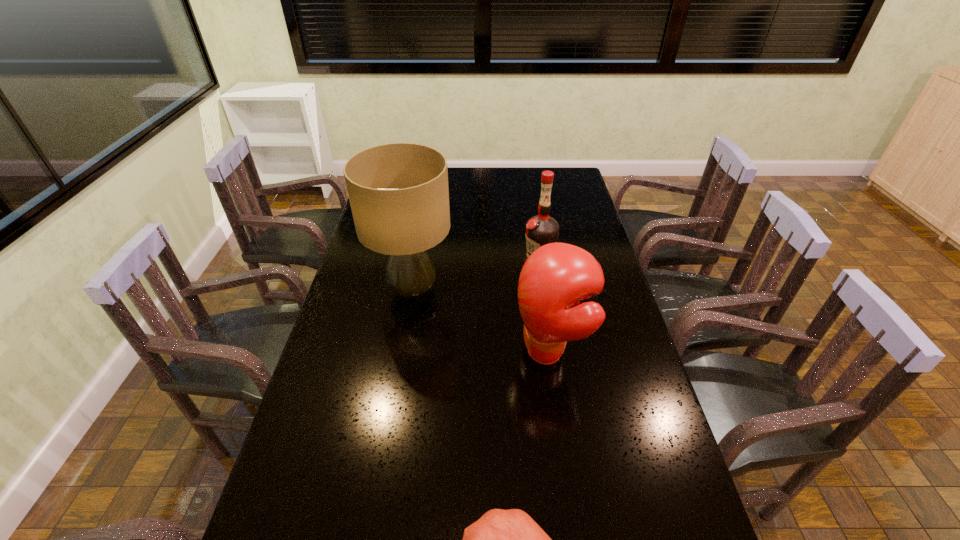
Where is `the leftmost object`? the leftmost object is located at coordinates (399, 196).

Image resolution: width=960 pixels, height=540 pixels. Find the location of `lampshade`. lampshade is located at coordinates (399, 196).

Where is `liquor`? liquor is located at coordinates (542, 229).

The width and height of the screenshot is (960, 540). Identify the location of the third farthest object. (554, 279).

The width and height of the screenshot is (960, 540). Identify the location of vacant area situated 0.160m on the back of the leftmost object. (421, 239).

Locate an element on the screen. vacant region located 0.190m on the front and back of the liquor is located at coordinates (470, 262).

The height and width of the screenshot is (540, 960). In order to click on free location located on the front and back of the liquor in this screenshot , I will do `click(451, 262)`.

Where is `free space located 0.390m on the front and back of the liquor`? The image size is (960, 540). free space located 0.390m on the front and back of the liquor is located at coordinates (415, 262).

You are a GUI agent. You are given a task and a screenshot of the screen. Output one action in this format:
    pyautogui.click(x=<x>, y=<y>)
    Task: Click on the free spot located on the striking surface of the boxing glove
    
    Given the screenshot: What is the action you would take?
    pyautogui.click(x=391, y=352)

This screenshot has width=960, height=540. In order to click on free location located 0.350m on the striking surface of the boxing glove in this screenshot , I will do `click(395, 352)`.